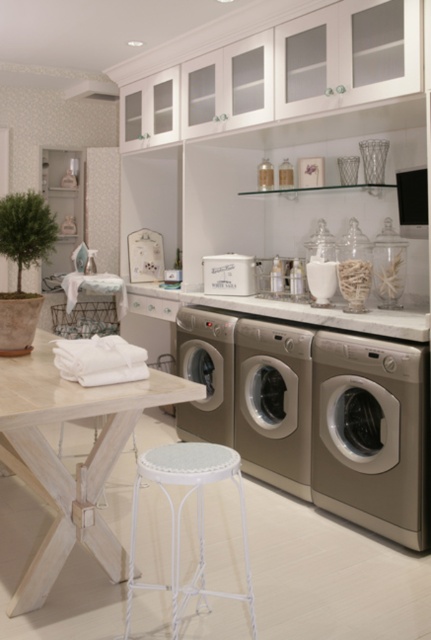
You are moving a laundry basket from the satin silver washing machine at center to the white stool in front of the wooden table. The laundry basket is 2 feet wide. Can you carry it sideways without hitting anything?

The distance between the satin silver washing machine at center and the white stool in front of the wooden table is 10.16 feet. Since the laundry basket is only 2 feet wide, you can easily carry it sideways without any issues as the space is more than sufficient.

You are moving a white metal stool at lower center and a satin beige washing machine at center into this laundry room. The doorway is 70 cm wide. Which object can fit through the doorway without needing to be tilted or rotated?

The satin beige washing machine at center can fit through the doorway since it is smaller in size than the white metal stool at lower center, which may not fit through the 70 cm wide doorway without adjustments.

You are a cleaning robot with a width of 0.8 meters. You are positioned near the white metal stool at lower center and want to move to the satin beige washing machine at center. Can you navigate the space between them without any obstacles?

The distance between the white metal stool at lower center and the satin beige washing machine at center is 1.31 meters. Since the robot is 0.8 meters wide, there is sufficient space for it to move between them as the distance is greater than the robot width.